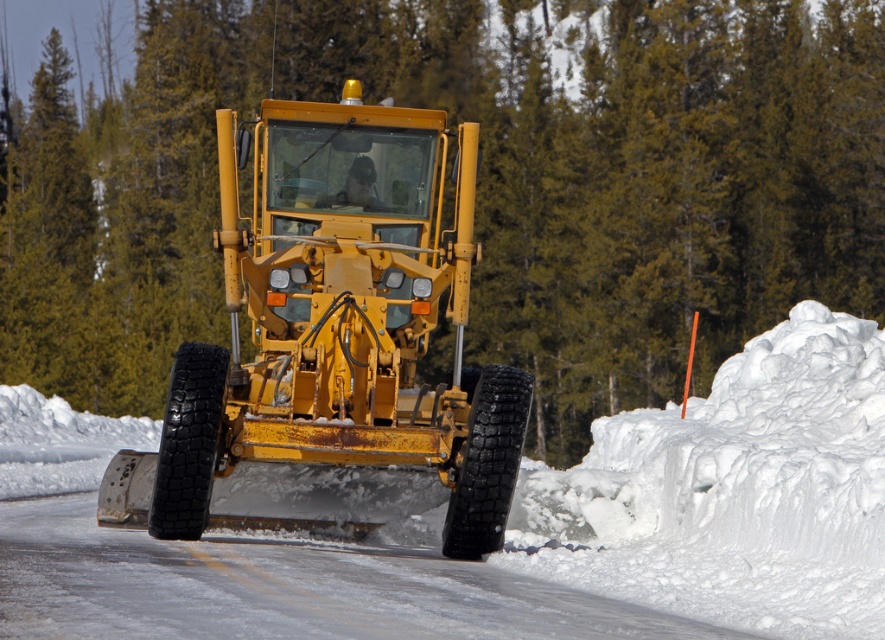
Question: Observing the image, what is the correct spatial positioning of white fluffy snow at center in reference to yellow metallic snowplow at center?

Choices:
 (A) left
 (B) right

Answer: (A)

Question: Among these objects, which one is nearest to the camera?

Choices:
 (A) yellow metallic snowplow at center
 (B) green textured tree at upper center
 (C) white fluffy snow at center

Answer: (C)

Question: Is green textured tree at upper center below yellow metallic snowplow at center?

Choices:
 (A) no
 (B) yes

Answer: (A)

Question: Which point appears farthest from the camera in this image?

Choices:
 (A) (358, 458)
 (B) (435, 337)
 (C) (578, 524)

Answer: (B)

Question: Which point is closer to the camera?

Choices:
 (A) white fluffy snow at center
 (B) green textured tree at upper center
 (C) yellow metallic snowplow at center

Answer: (A)

Question: Can you confirm if white fluffy snow at center is positioned above yellow metallic snowplow at center?

Choices:
 (A) yes
 (B) no

Answer: (B)